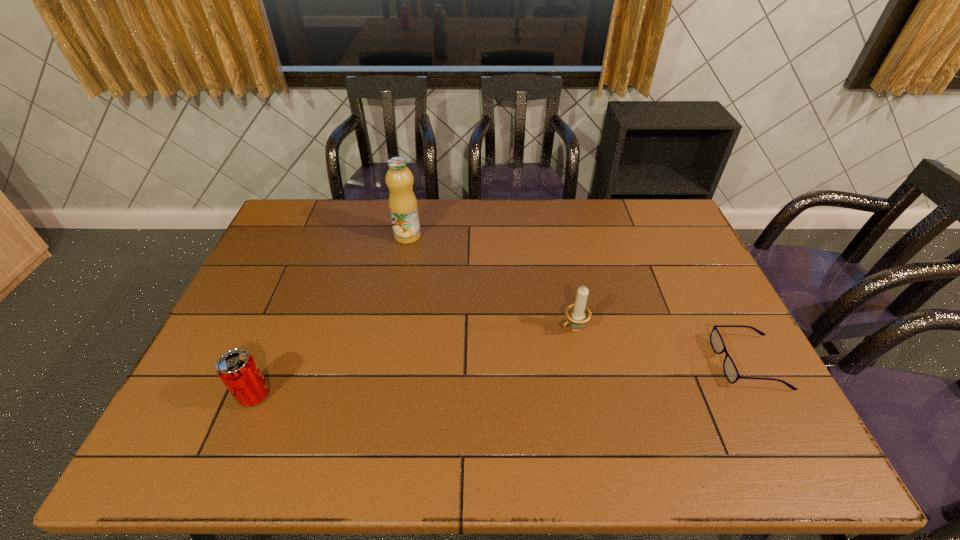
Where is `blank space that satisfies the following two spatial constraints: 1. on the front side of the candle_holder; 2. on the front-facing side of the spectacles`? This screenshot has height=540, width=960. blank space that satisfies the following two spatial constraints: 1. on the front side of the candle_holder; 2. on the front-facing side of the spectacles is located at coordinates pos(580,363).

Where is `blank area in the image that satisfies the following two spatial constraints: 1. on the front side of the second object from right to left; 2. on the left side of the tallest object`? This screenshot has width=960, height=540. blank area in the image that satisfies the following two spatial constraints: 1. on the front side of the second object from right to left; 2. on the left side of the tallest object is located at coordinates (391, 328).

Where is `free point that satisfies the following two spatial constraints: 1. on the back side of the soda can; 2. on the right side of the third object from left to right`? The height and width of the screenshot is (540, 960). free point that satisfies the following two spatial constraints: 1. on the back side of the soda can; 2. on the right side of the third object from left to right is located at coordinates (282, 328).

At what (x,y) coordinates should I click in order to perform the action: click on vacant area in the image that satisfies the following two spatial constraints: 1. on the back side of the shortest object; 2. on the front-facing side of the soda can. Please return your answer as a coordinate pair (x, y). The image size is (960, 540). Looking at the image, I should click on (268, 363).